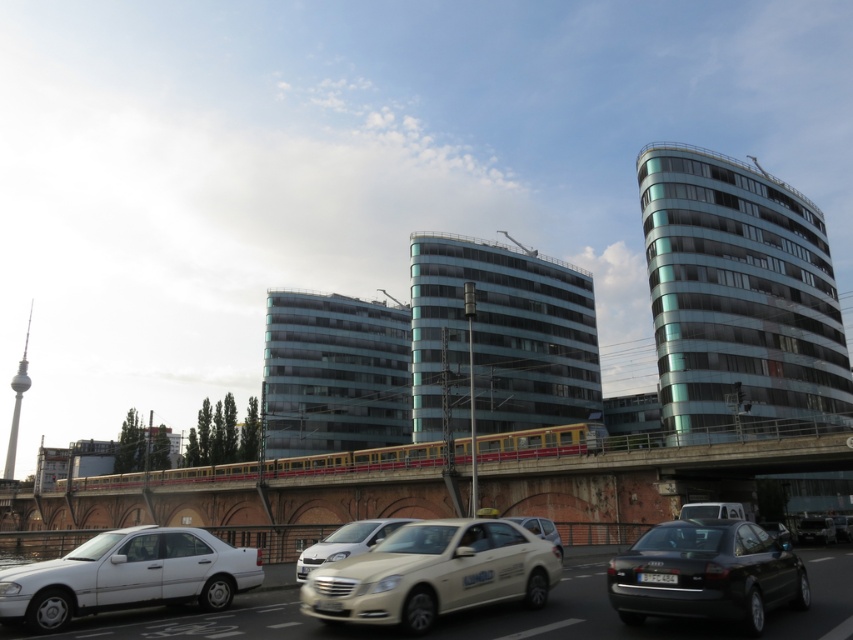
Question: Which object is farther from the camera taking this photo?

Choices:
 (A) white glossy taxi at center
 (B) shiny black sedan at lower right
 (C) matte silver sedan at center
 (D) white matte sedan at lower left

Answer: (C)

Question: Does concrete bridge at center have a smaller size compared to matte silver sedan at center?

Choices:
 (A) no
 (B) yes

Answer: (A)

Question: Which object is farther from the camera taking this photo?

Choices:
 (A) white glossy sedan at center
 (B) white glossy car at lower center

Answer: (A)

Question: Can you confirm if white matte sedan at lower left is thinner than metallic silver sedan at center?

Choices:
 (A) yes
 (B) no

Answer: (A)

Question: Observing the image, what is the correct spatial positioning of concrete bridge at center in reference to matte silver sedan at center?

Choices:
 (A) below
 (B) above

Answer: (A)

Question: Estimate the real-world distances between objects in this image. Which object is farther from the matte silver sedan at center?

Choices:
 (A) white glossy sedan at center
 (B) metallic silver sedan at center
 (C) white glossy taxi at center
 (D) white glossy car at lower center

Answer: (B)